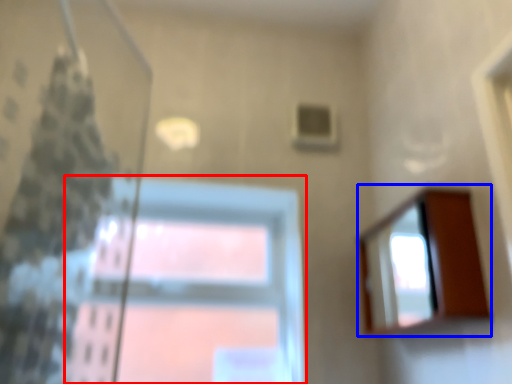
Question: Among these objects, which one is farthest to the camera, window (highlighted by a red box) or mirror (highlighted by a blue box)?

Choices:
 (A) window
 (B) mirror

Answer: (A)